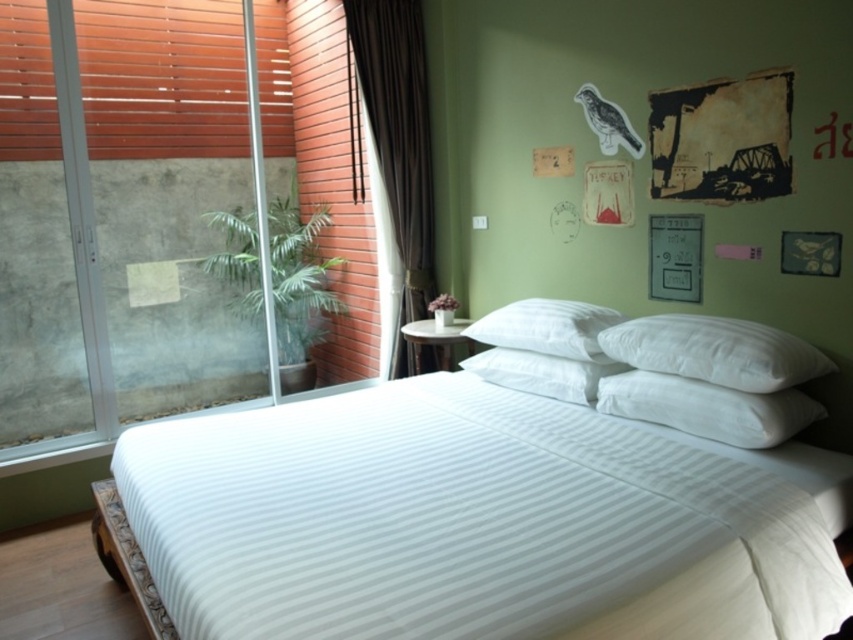
Question: Which object appears closest to the camera in this image?

Choices:
 (A) transparent glass screen door at left
 (B) white striped bed at center

Answer: (B)

Question: Does white striped bed at center have a smaller size compared to dark brown fabric curtain at left?

Choices:
 (A) no
 (B) yes

Answer: (A)

Question: Can you confirm if white striped bed at center is positioned below white textured pillow at center?

Choices:
 (A) yes
 (B) no

Answer: (A)

Question: Is white striped bed at center wider than white soft pillow at upper right?

Choices:
 (A) yes
 (B) no

Answer: (A)

Question: Considering the real-world distances, which object is farthest from the white soft pillow at center?

Choices:
 (A) white textured pillow at center
 (B) white soft pillow at upper right
 (C) dark brown fabric curtain at left

Answer: (C)

Question: Which point is closer to the camera taking this photo?

Choices:
 (A) (241, 438)
 (B) (689, 365)
 (C) (689, 426)
 (D) (18, 138)

Answer: (C)